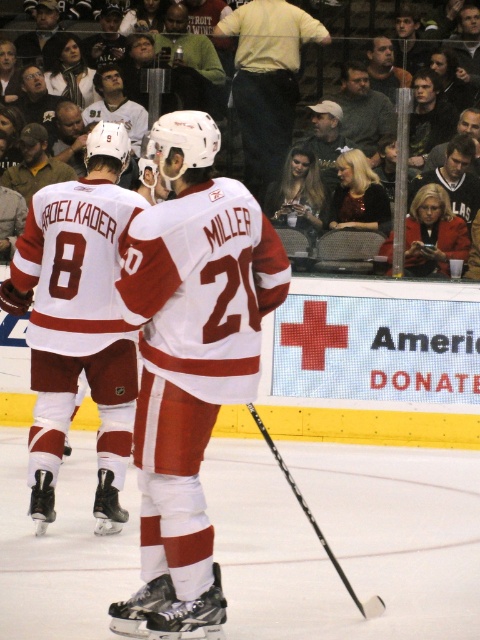
You are a photographer at the ice hockey game and want to take a photo of the white matte jersey at center and the black matte hockey stick at center. Which object should you focus on first if you want to capture both clearly in the frame?

The white matte jersey at center is bigger than the black matte hockey stick at center, so you should focus on the white matte jersey at center first as it occupies more space in the frame.

You are a referee watching the ice hockey game. You notice the white jersey at center and the black matte hockey stick at center. Which one is closer to you?

The white jersey at center is closer to you because it is in front of the black matte hockey stick at center.

You are a photographer at the ice hockey game. You need to take a photo of both the white jersey at center and the white matte jersey at center. Which jersey should you focus on if you want to capture the one that appears narrower in the photo?

The white jersey at center is thinner than the white matte jersey at center, so you should focus on the white jersey at center to capture the narrower one.